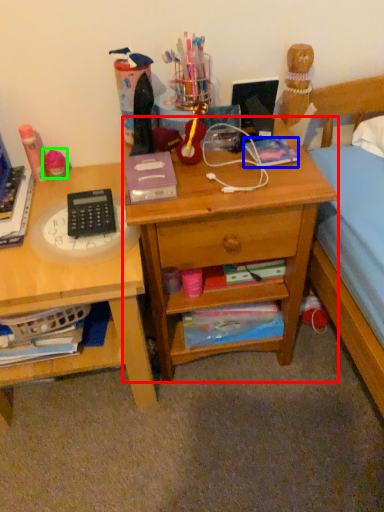
Question: Which is farther away from desk (highlighted by a red box)? paperback book (highlighted by a blue box) or stationery (highlighted by a green box)?

Choices:
 (A) paperback book
 (B) stationery

Answer: (B)